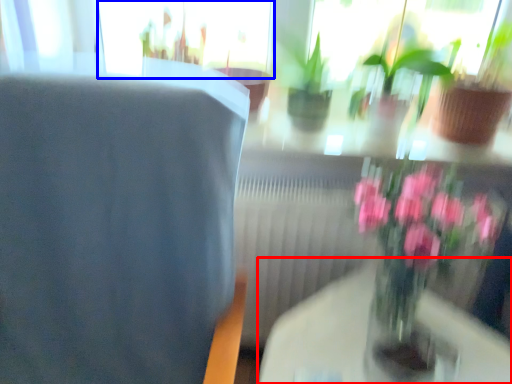
Question: Which object is closer to the camera taking this photo, round table (highlighted by a red box) or glass door (highlighted by a blue box)?

Choices:
 (A) round table
 (B) glass door

Answer: (A)